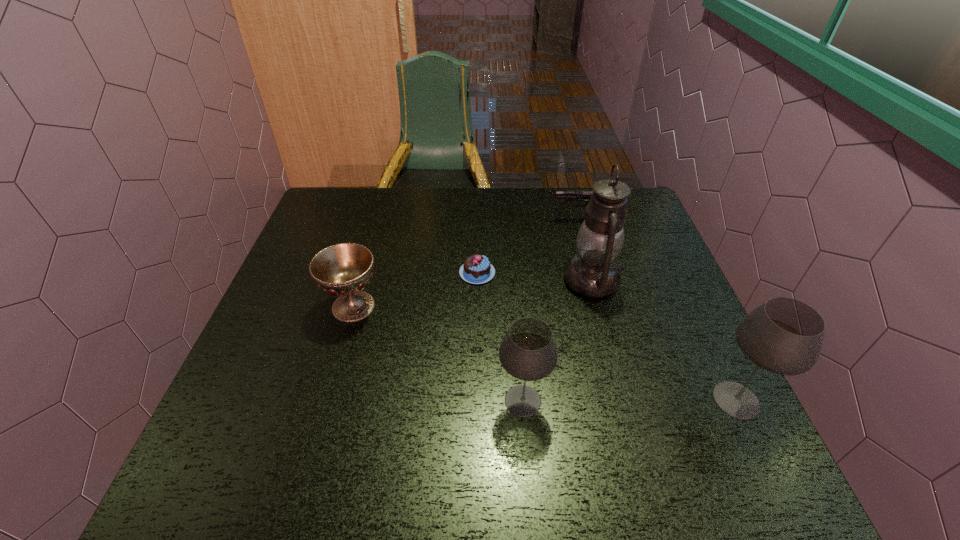
You are a GUI agent. You are given a task and a screenshot of the screen. Output one action in this format:
    pyautogui.click(x=<x>, y=<y>)
    Task: Click on the shorter wineglass
    The image size is (960, 540).
    Given the screenshot: What is the action you would take?
    pyautogui.click(x=528, y=351)

I want to click on the fourth shortest object, so click(x=528, y=351).

Identify the location of the taller wineglass. The height and width of the screenshot is (540, 960). click(x=784, y=336).

At what (x,y) coordinates should I click in order to perform the action: click on the rightmost object. Please return your answer as a coordinate pair (x, y). The width and height of the screenshot is (960, 540). Looking at the image, I should click on (784, 336).

The height and width of the screenshot is (540, 960). Find the location of `the fifth tallest object`. the fifth tallest object is located at coordinates (560, 195).

Find the location of `pistol`. pistol is located at coordinates (560, 195).

What are the coordinates of `the leftmost object` in the screenshot? It's located at (344, 269).

Identify the location of the fourth tallest object. (344, 269).

Find the location of a particular element. This screenshot has width=960, height=540. oil lamp is located at coordinates (593, 272).

You are a GUI agent. You are given a task and a screenshot of the screen. Output one action in this format:
    pyautogui.click(x=<x>, y=<y>)
    Task: Click on the shortest object
    
    Given the screenshot: What is the action you would take?
    pyautogui.click(x=476, y=269)